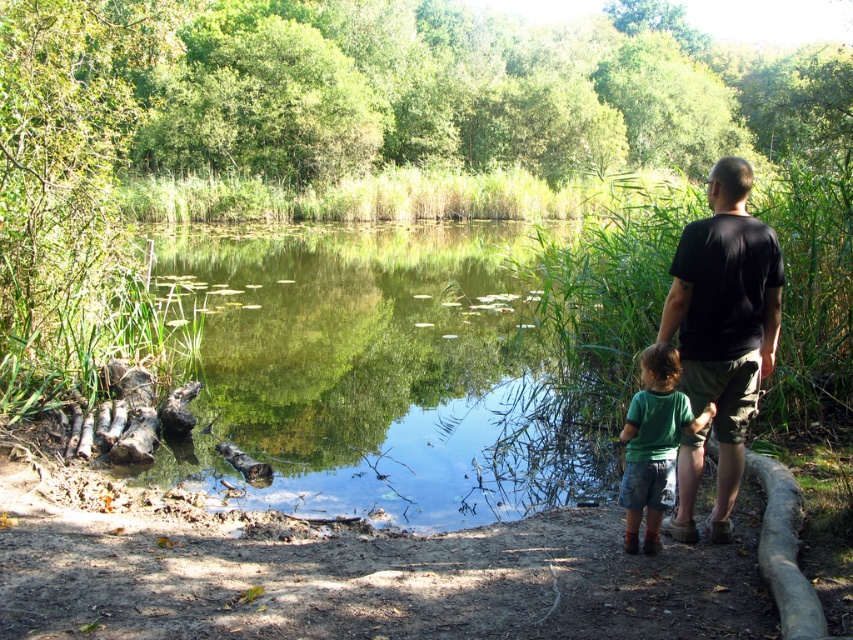
Does green reflective water at center appear over green cotton shirt at lower center?

Yes.

Between point (228, 468) and point (648, 470), which one is positioned behind?

Positioned behind is point (228, 468).

What are the coordinates of `green reflective water at center` in the screenshot? It's located at click(370, 376).

Who is more distant from viewer, (398, 332) or (671, 337)?

The point (398, 332) is more distant.

The image size is (853, 640). I want to click on green reflective water at center, so pos(370,376).

Between black cotton shirt at right and green cotton shirt at lower center, which one has more height?

green cotton shirt at lower center is taller.

Where is `black cotton shirt at right`? black cotton shirt at right is located at coordinates (724, 320).

Between point (701, 449) and point (682, 401), which one is positioned in front?

Point (682, 401) is more forward.

This screenshot has height=640, width=853. I want to click on black cotton shirt at right, so click(724, 320).